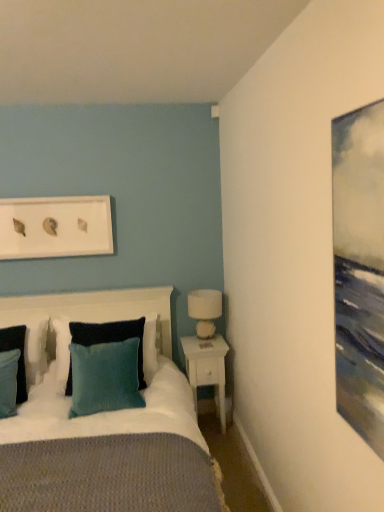
Question: From the image's perspective, does white wood nightstand at lower right appear lower than teal velvet pillow at center, arranged as the 3th pillow when viewed from the left?

Choices:
 (A) no
 (B) yes

Answer: (B)

Question: Could you tell me if white wood nightstand at lower right is turned towards teal velvet pillow at center, arranged as the 3th pillow when viewed from the left?

Choices:
 (A) yes
 (B) no

Answer: (B)

Question: Could teal velvet pillow at center, arranged as the 3th pillow when viewed from the left, be considered to be inside white wood nightstand at lower right?

Choices:
 (A) yes
 (B) no

Answer: (B)

Question: Can you confirm if white wood nightstand at lower right is thinner than teal velvet pillow at center, the first pillow in the right-to-left sequence?

Choices:
 (A) no
 (B) yes

Answer: (B)

Question: From a real-world perspective, is white wood nightstand at lower right located higher than teal velvet pillow at center, the first pillow in the right-to-left sequence?

Choices:
 (A) yes
 (B) no

Answer: (B)

Question: Does white wood nightstand at lower right have a smaller size compared to teal velvet pillow at center, arranged as the 3th pillow when viewed from the left?

Choices:
 (A) yes
 (B) no

Answer: (A)

Question: Considering the relative sizes of white matte picture frame at upper center and teal velvet pillow at center, arranged as the 3th pillow when viewed from the left, in the image provided, is white matte picture frame at upper center wider than teal velvet pillow at center, arranged as the 3th pillow when viewed from the left,?

Choices:
 (A) yes
 (B) no

Answer: (B)

Question: Considering the relative sizes of white matte picture frame at upper center and teal velvet pillow at center, the first pillow in the right-to-left sequence, in the image provided, is white matte picture frame at upper center shorter than teal velvet pillow at center, the first pillow in the right-to-left sequence,?

Choices:
 (A) yes
 (B) no

Answer: (A)

Question: Can you confirm if white matte picture frame at upper center is thinner than teal velvet pillow at center, arranged as the 3th pillow when viewed from the left?

Choices:
 (A) yes
 (B) no

Answer: (A)

Question: Is white matte picture frame at upper center at the right side of teal velvet pillow at center, arranged as the 3th pillow when viewed from the left?

Choices:
 (A) no
 (B) yes

Answer: (A)

Question: Is white matte picture frame at upper center beside teal velvet pillow at center, arranged as the 3th pillow when viewed from the left?

Choices:
 (A) yes
 (B) no

Answer: (B)

Question: Is teal velvet pillow at center, the first pillow in the right-to-left sequence, at the back of white matte picture frame at upper center?

Choices:
 (A) no
 (B) yes

Answer: (A)

Question: Could you tell me if white wood nightstand at lower right is facing white matte picture frame at upper center?

Choices:
 (A) yes
 (B) no

Answer: (B)